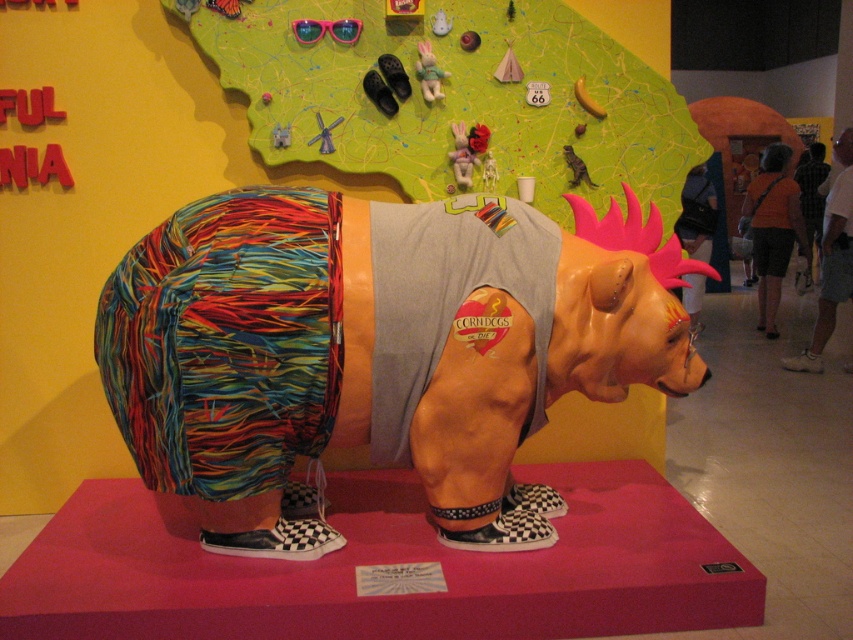
You are standing in front of the bear sculpture and want to touch two specific points on it. The first point is at coordinate point (437,266) and the second is at point (805,268). Which point will require you to reach higher to touch?

Point (805,268) is higher than point (437,266), so you will need to reach higher to touch point (805,268).

You are an art student analyzing the bear sculpture. You notice the orange fabric shorts at right and the checkered shirt at center. Which object is positioned to the left of the other?

The orange fabric shorts at right is to the left of checkered shirt at center.